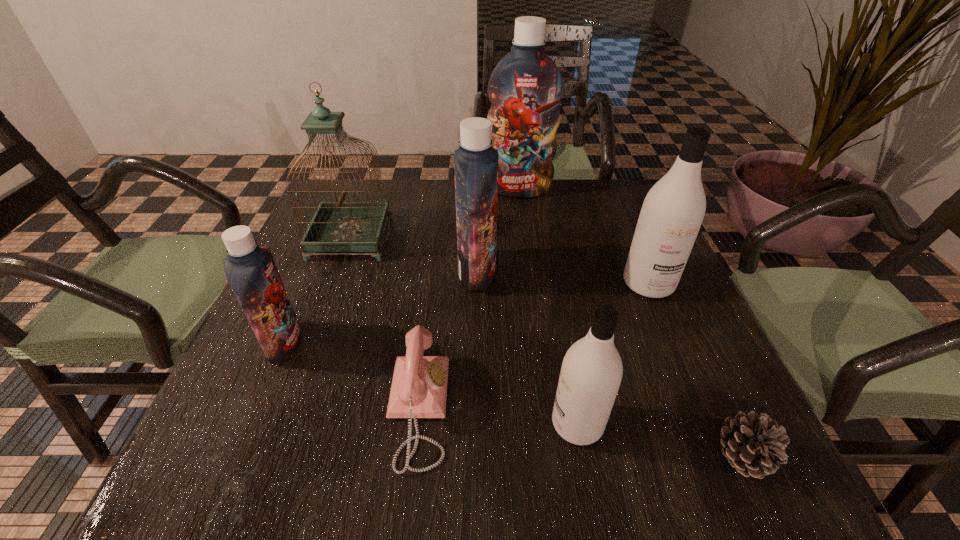
Identify the location of free space between the nearer white shampoo and the farthest object. [548, 307].

Find the location of `free space between the seventh tallest object and the birdcage`. free space between the seventh tallest object and the birdcage is located at coordinates (384, 323).

Find the location of a particular element. free space that is in between the birdcage and the farthest blue shampoo is located at coordinates (435, 214).

Where is `vacant point located between the leftmost shampoo and the greenish birdcage`? The width and height of the screenshot is (960, 540). vacant point located between the leftmost shampoo and the greenish birdcage is located at coordinates (318, 291).

Find the location of a particular element. The width and height of the screenshot is (960, 540). the third closest object relative to the second smallest blue shampoo is located at coordinates (525, 88).

This screenshot has height=540, width=960. What are the coordinates of `object that is the third closest to the pinecone` in the screenshot? It's located at (419, 386).

Select which shampoo is the fourth closest to the greenish birdcage. Please provide its 2D coordinates. Your answer should be formatted as a tuple, i.e. [(x, y)], where the tuple contains the x and y coordinates of a point satisfying the conditions above.

[(591, 372)]

What are the coordinates of `the fourth closest shampoo to the pinecone` in the screenshot? It's located at (525, 88).

This screenshot has width=960, height=540. What are the coordinates of `the third closest blue shampoo to the shortest object` in the screenshot? It's located at (250, 269).

Image resolution: width=960 pixels, height=540 pixels. In order to click on blue shampoo object that ranks as the second closest to the shortest object in this screenshot , I will do `click(525, 88)`.